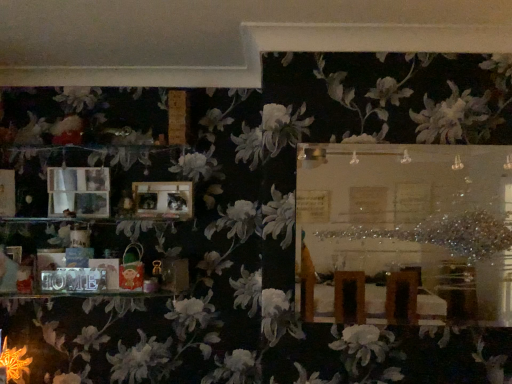
Question: Do you think matte wooden picture frame at left, the 1th picture frame from the left, is within wooden photo frame at center, the second picture frame positioned from the left, or outside of it?

Choices:
 (A) outside
 (B) inside

Answer: (A)

Question: From their relative heights in the image, would you say matte wooden picture frame at left, which is the second picture frame from right to left, is taller or shorter than wooden photo frame at center, the first picture frame when ordered from right to left?

Choices:
 (A) tall
 (B) short

Answer: (A)

Question: Which object is the closest to the matte plastic bag at lower left?

Choices:
 (A) matte wooden picture frame at left, which is the second picture frame from right to left
 (B) orange textured flower at lower left
 (C) wooden frame at upper center
 (D) wooden photo frame at center, the second picture frame positioned from the left

Answer: (D)

Question: Which of these objects is positioned closest to the wooden frame at upper center?

Choices:
 (A) matte wooden picture frame at left, the 1th picture frame from the left
 (B) matte plastic bag at lower left
 (C) orange textured flower at lower left
 (D) wooden photo frame at center, the second picture frame positioned from the left

Answer: (D)